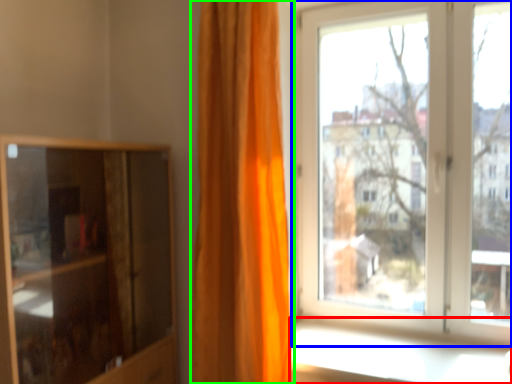
Question: Which object is the farthest from window sill (highlighted by a red box)? Choose among these: window (highlighted by a blue box) or curtain (highlighted by a green box).

Choices:
 (A) window
 (B) curtain

Answer: (A)